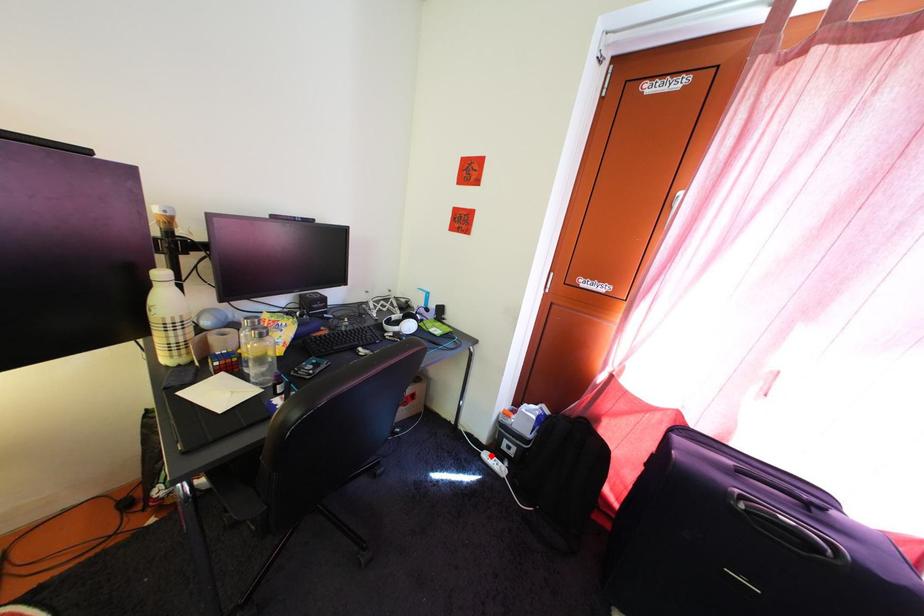
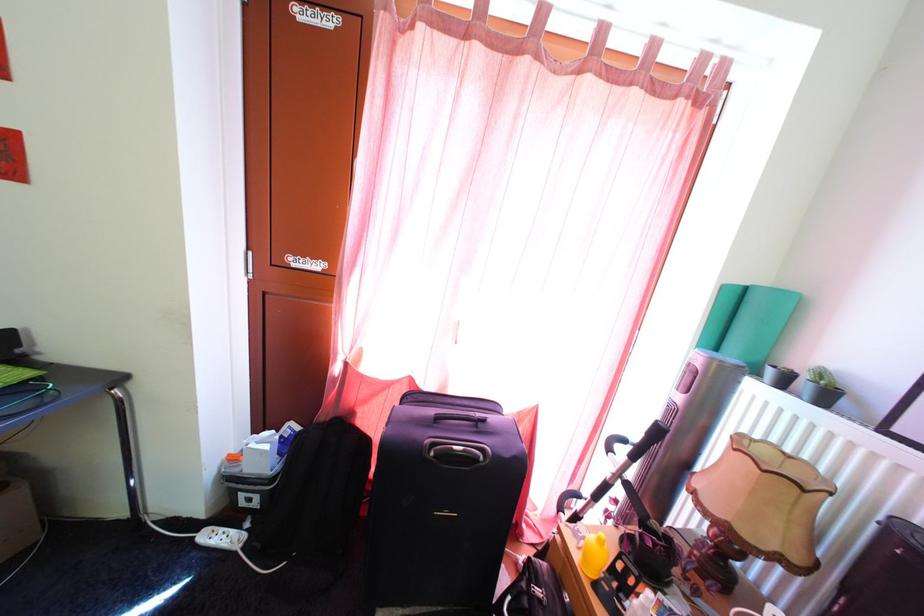
Find the pixel in the second image that matches the highlighted location in the first image.

(208, 533)